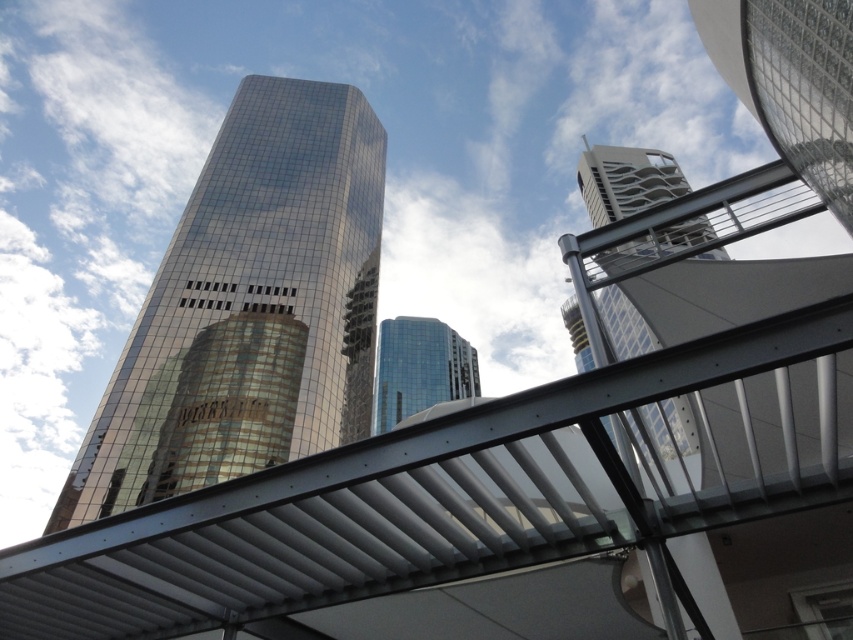
Question: Is shiny glass skyscraper at center smaller than reflective glass skyscraper at upper right?

Choices:
 (A) yes
 (B) no

Answer: (A)

Question: Does shiny glass skyscraper at center appear over reflective glass skyscraper at upper right?

Choices:
 (A) no
 (B) yes

Answer: (B)

Question: Which point appears closest to the camera in this image?

Choices:
 (A) (225, 205)
 (B) (657, 173)

Answer: (A)

Question: Does shiny glass skyscraper at center appear on the left side of glossy glass building at center?

Choices:
 (A) no
 (B) yes

Answer: (B)

Question: Which point is farther to the camera?

Choices:
 (A) (619, 189)
 (B) (292, 353)

Answer: (A)

Question: Which point appears closest to the camera in this image?

Choices:
 (A) (260, 312)
 (B) (386, 381)
 (C) (640, 189)

Answer: (A)